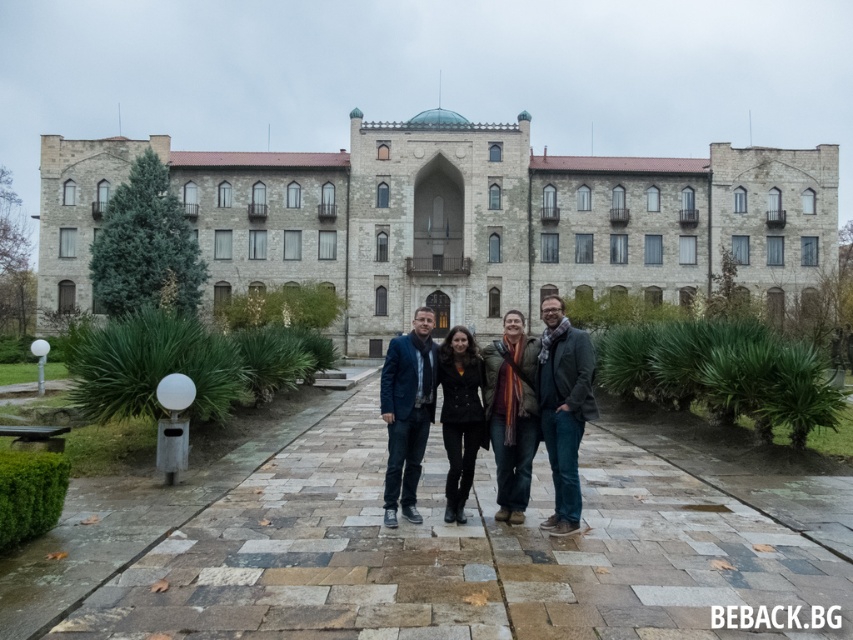
Question: Is dark blue textured blazer at center above black leather jacket at center?

Choices:
 (A) no
 (B) yes

Answer: (B)

Question: Is dark gray wool scarf at center thinner than black leather jacket at center?

Choices:
 (A) no
 (B) yes

Answer: (A)

Question: Which object appears closest to the camera in this image?

Choices:
 (A) dark blue textured blazer at center
 (B) black leather jacket at center
 (C) dark gray wool scarf at center
 (D) orange striped scarf at center

Answer: (C)

Question: Which of these objects is positioned closest to the dark gray wool scarf at center?

Choices:
 (A) dark blue textured blazer at center
 (B) orange striped scarf at center

Answer: (B)

Question: Which object is positioned closest to the orange striped scarf at center?

Choices:
 (A) dark gray wool scarf at center
 (B) black leather jacket at center
 (C) dark blue textured blazer at center

Answer: (B)

Question: Is dark gray wool scarf at center to the left of black leather jacket at center from the viewer's perspective?

Choices:
 (A) no
 (B) yes

Answer: (A)